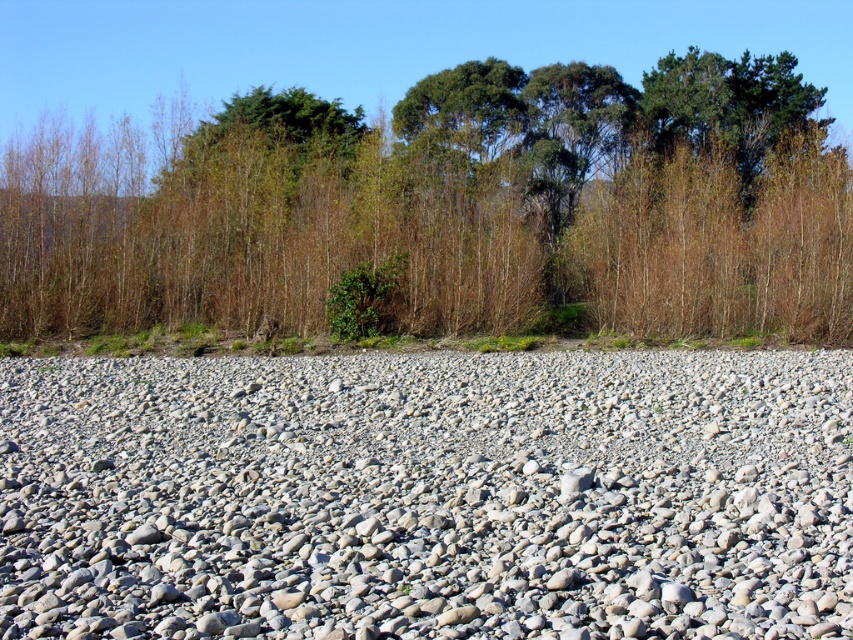
Is gray gravel at center thinner than brown wood tree at upper center?

Yes, gray gravel at center is thinner than brown wood tree at upper center.

Can you confirm if gray gravel at center is positioned to the left of brown wood tree at upper center?

Yes, gray gravel at center is to the left of brown wood tree at upper center.

The image size is (853, 640). In order to click on gray gravel at center in this screenshot , I will do `click(427, 496)`.

The image size is (853, 640). In order to click on gray gravel at center in this screenshot , I will do pos(427,496).